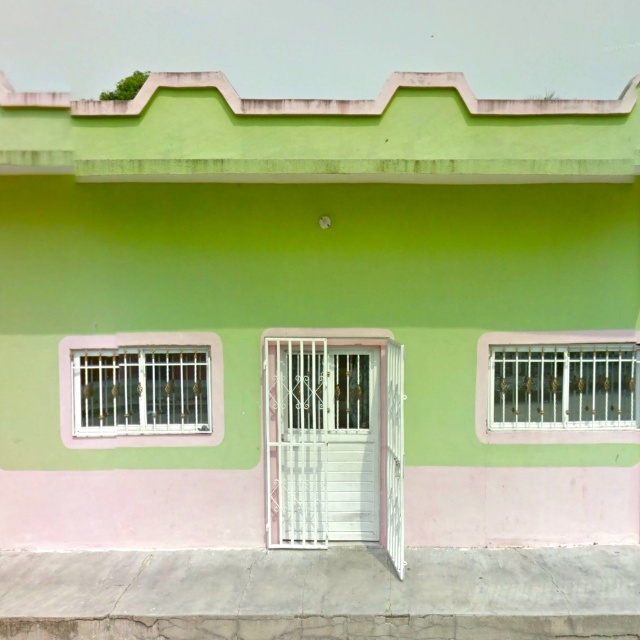
Question: Which point is farther to the camera?

Choices:
 (A) white metal window at left
 (B) white metal window at right

Answer: (A)

Question: Is white metal window at left bigger than white metal window at right?

Choices:
 (A) yes
 (B) no

Answer: (A)

Question: Is white metal window at left wider than white metal window at right?

Choices:
 (A) no
 (B) yes

Answer: (A)

Question: Which of the following is the farthest from the observer?

Choices:
 (A) (634, 339)
 (B) (88, 340)

Answer: (B)

Question: Is white metal window at left bigger than white metal window at right?

Choices:
 (A) no
 (B) yes

Answer: (B)

Question: Which object appears farthest from the camera in this image?

Choices:
 (A) white metal window at left
 (B) white metal window at right

Answer: (A)